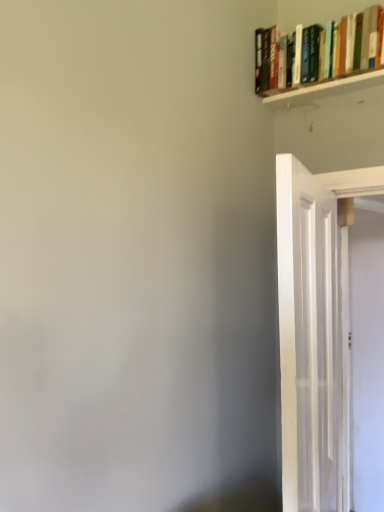
This screenshot has height=512, width=384. What do you see at coordinates (315, 333) in the screenshot?
I see `white wooden door at right` at bounding box center [315, 333].

The image size is (384, 512). In order to click on white wooden door at right in this screenshot , I will do `click(315, 333)`.

Locate an element on the screen. Image resolution: width=384 pixels, height=512 pixels. white wooden door at right is located at coordinates click(315, 333).